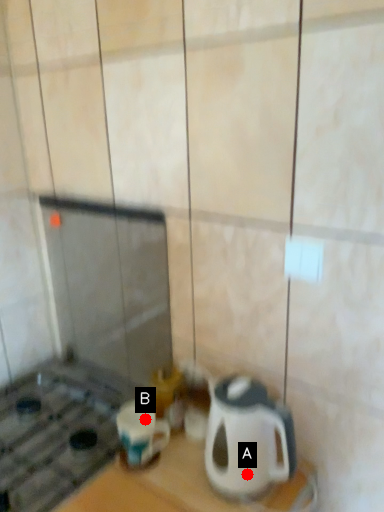
Question: Two points are circled on the image, labeled by A and B beside each circle. Which point is closer to the camera?

Choices:
 (A) A is closer
 (B) B is closer

Answer: (A)